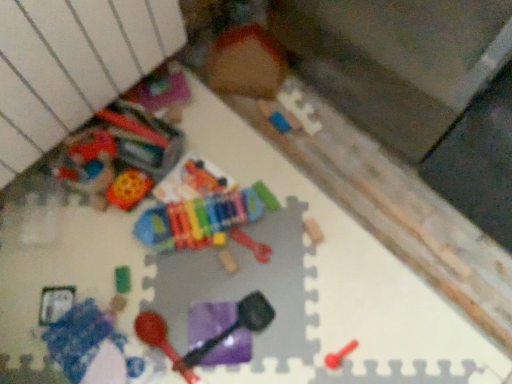
The width and height of the screenshot is (512, 384). Find the location of `free spot above blue fabric blanket at lower left, which ranks as the 7th toy in right-to-left order (from a real-world perspective)`. free spot above blue fabric blanket at lower left, which ranks as the 7th toy in right-to-left order (from a real-world perspective) is located at coordinates (84, 349).